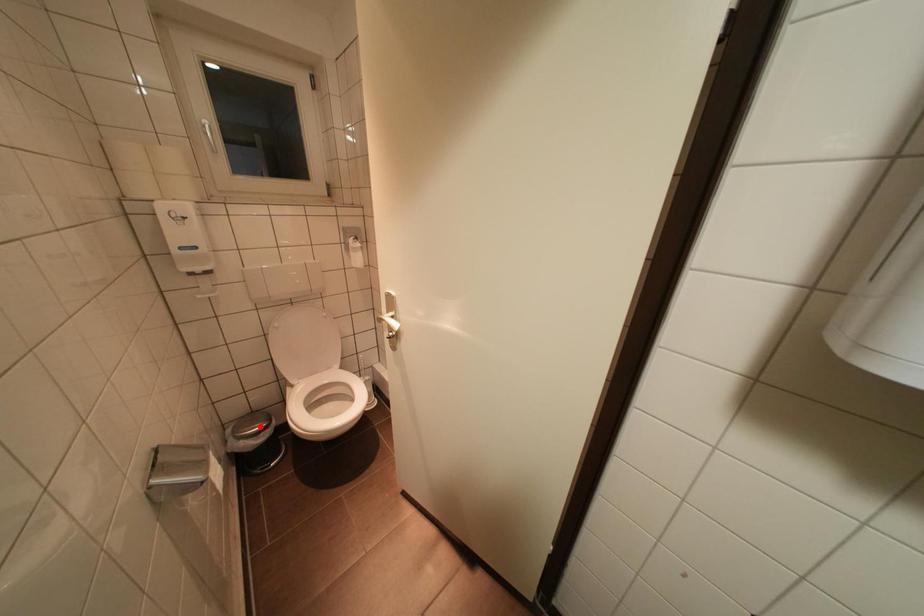
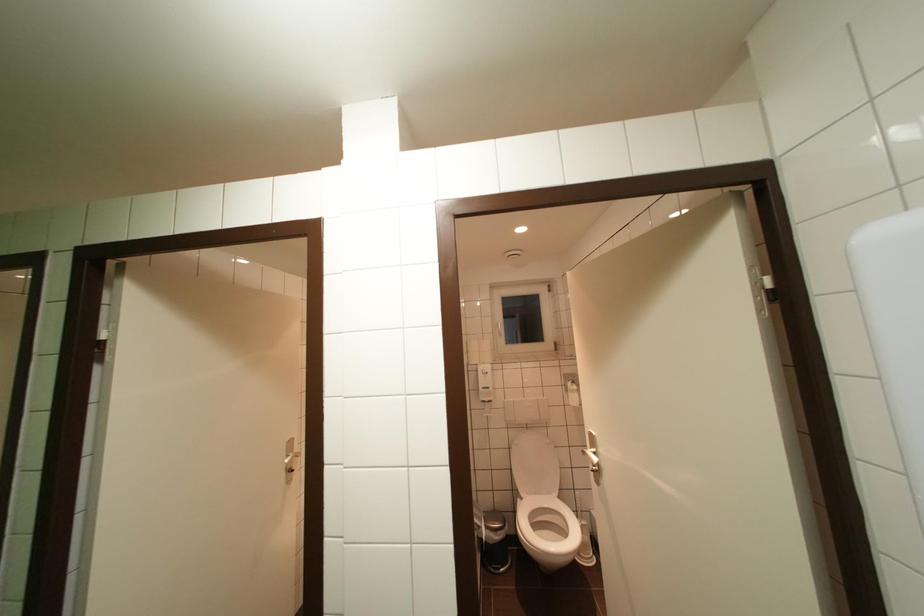
Locate, in the second image, the point that corresponds to the highlighted location in the first image.

(502, 523)